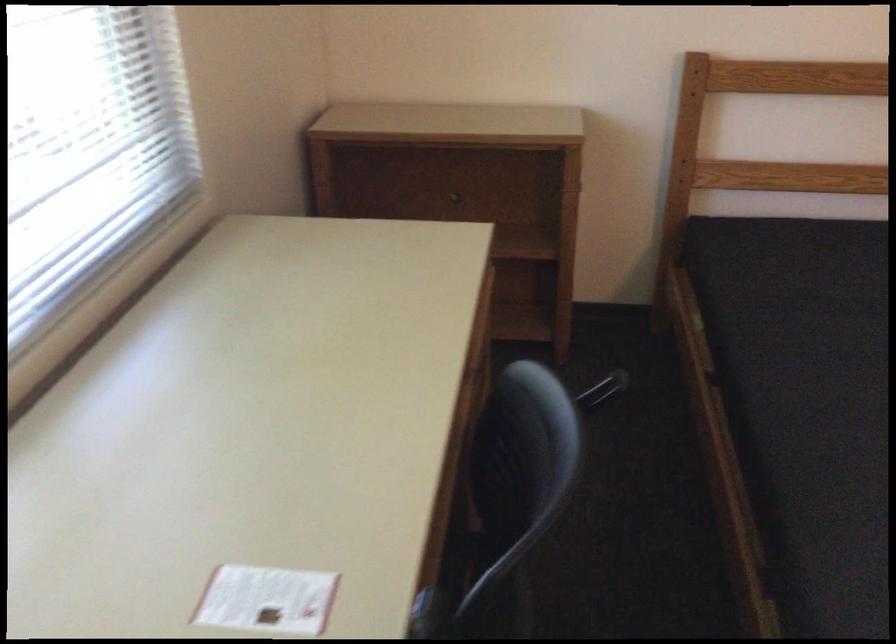
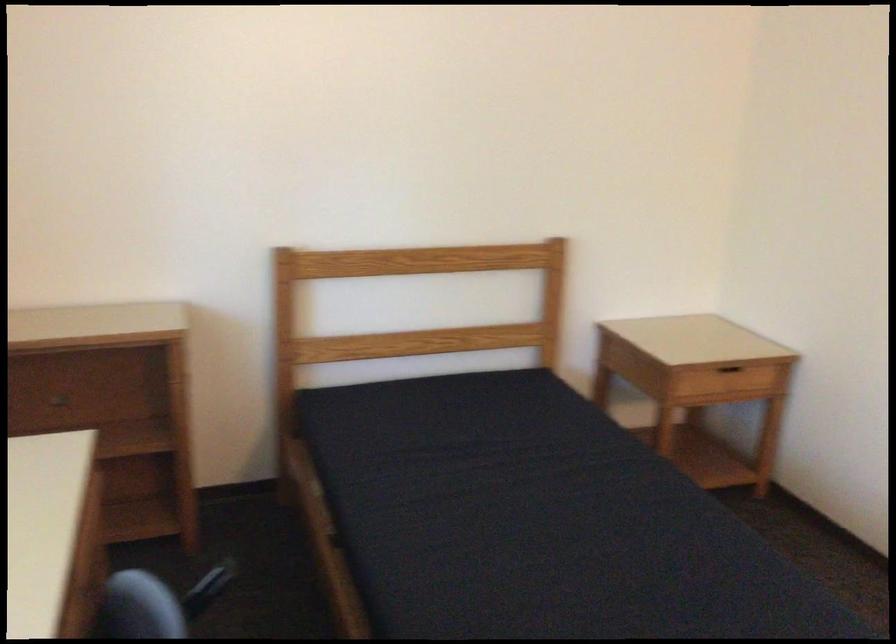
Question: How did the camera likely rotate?

Choices:
 (A) Left
 (B) Right
 (C) Up
 (D) Down

Answer: (B)